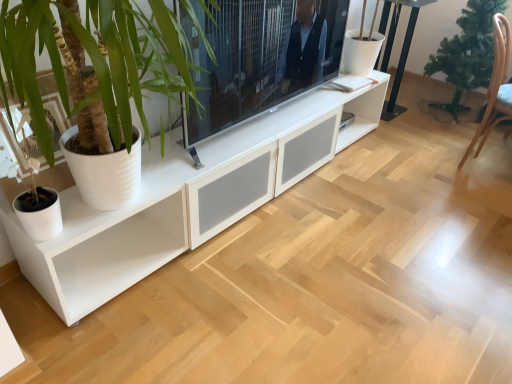
Question: Is green matte christmas tree at right wider or thinner than black metal table at upper right?

Choices:
 (A) wide
 (B) thin

Answer: (A)

Question: From a real-world perspective, is green matte christmas tree at right positioned above or below black metal table at upper right?

Choices:
 (A) above
 (B) below

Answer: (A)

Question: Estimate the real-world distances between objects in this image. Which object is closer to the brown wooden armchair at right?

Choices:
 (A) white matte cabinet at center
 (B) green matte christmas tree at right
 (C) matte black tv at center
 (D) black metal table at upper right

Answer: (B)

Question: Estimate the real-world distances between objects in this image. Which object is farther from the black metal table at upper right?

Choices:
 (A) green matte christmas tree at right
 (B) matte black tv at center
 (C) white matte cabinet at center
 (D) brown wooden armchair at right

Answer: (C)